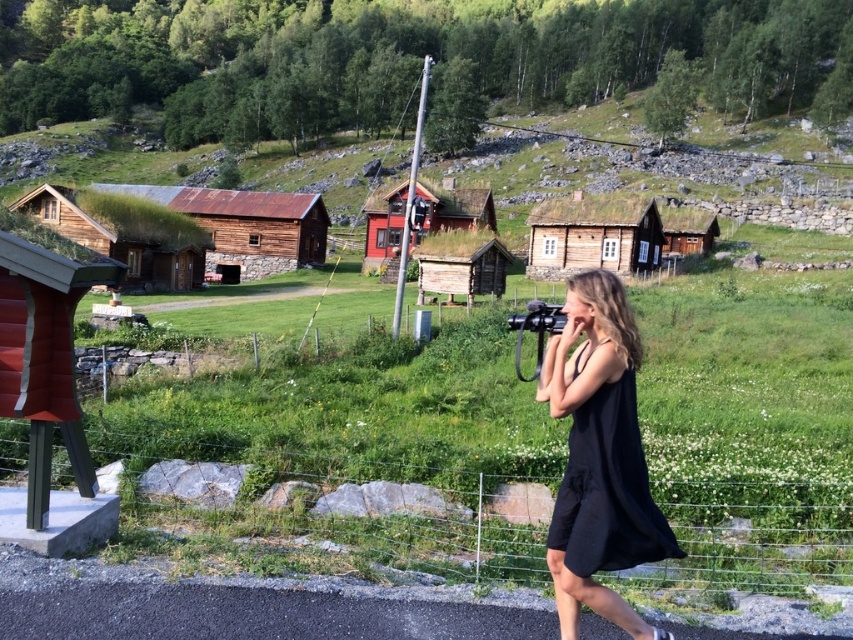
Can you confirm if wire mesh fence at lower center is thinner than wooden log cabin at center?

In fact, wire mesh fence at lower center might be wider than wooden log cabin at center.

Between point (170, 486) and point (467, 253), which one is positioned in front?

Point (170, 486)

The width and height of the screenshot is (853, 640). In order to click on wire mesh fence at lower center in this screenshot , I will do `click(335, 509)`.

Identify the location of wire mesh fence at lower center. (335, 509).

Which is behind, point (576, 506) or point (427, 243)?

Point (427, 243)

Is black matte dress at center further to the viewer compared to wooden log cabin at center?

No.

This screenshot has width=853, height=640. In order to click on black matte dress at center in this screenshot , I will do `click(607, 488)`.

This screenshot has height=640, width=853. What are the coordinates of `wooden thatched hut at center` in the screenshot? It's located at (611, 234).

Looking at this image, does wooden thatched hut at center have a lesser height compared to rusty wood hut at center?

Incorrect, wooden thatched hut at center's height does not fall short of rusty wood hut at center's.

Who is more forward, (618, 268) or (305, 246)?

Point (618, 268) is more forward.

I want to click on wooden thatched hut at center, so click(611, 234).